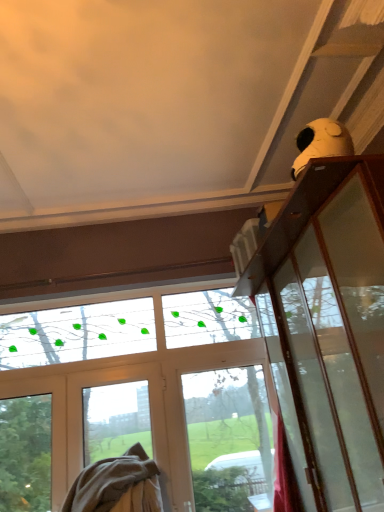
What do you see at coordinates (114, 442) in the screenshot? I see `white matte screen door at lower left` at bounding box center [114, 442].

At what (x,y) coordinates should I click in order to perform the action: click on white matte screen door at lower left. Please return your answer as a coordinate pair (x, y). The image size is (384, 512). Looking at the image, I should click on (114, 442).

Measure the distance between point (143, 507) and camera.

Point (143, 507) and camera are 8.64 feet apart.

What do you see at coordinates (117, 485) in the screenshot? I see `beige cotton blanket at lower left` at bounding box center [117, 485].

Identify the location of beige cotton blanket at lower left. (117, 485).

The width and height of the screenshot is (384, 512). Find the location of `white matte screen door at lower left`. white matte screen door at lower left is located at coordinates (114, 442).

Does beige cotton blanket at lower left appear on the right side of white matte screen door at lower left?

Incorrect, beige cotton blanket at lower left is not on the right side of white matte screen door at lower left.

Which is behind, beige cotton blanket at lower left or white matte screen door at lower left?

white matte screen door at lower left is further away from the camera.

Is point (115, 507) positioned behind point (91, 417)?

No.

From the image's perspective, which is below, beige cotton blanket at lower left or white matte screen door at lower left?

beige cotton blanket at lower left is shown below in the image.

From a real-world perspective, is beige cotton blanket at lower left located beneath white matte screen door at lower left?

Yes.

In the scene shown: In terms of width, does beige cotton blanket at lower left look wider or thinner when compared to white matte screen door at lower left?

In the image, beige cotton blanket at lower left appears to be wider than white matte screen door at lower left.

Who is shorter, beige cotton blanket at lower left or white matte screen door at lower left?

With less height is beige cotton blanket at lower left.

Can you confirm if beige cotton blanket at lower left is bigger than white matte screen door at lower left?

Yes, beige cotton blanket at lower left is bigger than white matte screen door at lower left.

Would you say beige cotton blanket at lower left is outside white matte screen door at lower left?

Yes.

Is beige cotton blanket at lower left not near white matte screen door at lower left?

No, beige cotton blanket at lower left is in close proximity to white matte screen door at lower left.

Based on the photo, is beige cotton blanket at lower left facing towards white matte screen door at lower left?

No, beige cotton blanket at lower left is not facing towards white matte screen door at lower left.

How many degrees apart are the facing directions of beige cotton blanket at lower left and white matte screen door at lower left?

The facing directions of beige cotton blanket at lower left and white matte screen door at lower left are 1.22 degrees apart.

How distant is beige cotton blanket at lower left from white matte screen door at lower left?

beige cotton blanket at lower left is 3.95 inches away from white matte screen door at lower left.

Find the location of a particular element. blanket that appears below the white matte screen door at lower left (from a real-world perspective) is located at coordinates (117, 485).

Considering the relative positions of white matte screen door at lower left and beige cotton blanket at lower left in the image provided, is white matte screen door at lower left to the left of beige cotton blanket at lower left from the viewer's perspective?

No, white matte screen door at lower left is not to the left of beige cotton blanket at lower left.

Relative to beige cotton blanket at lower left, is white matte screen door at lower left in front or behind?

In the image, white matte screen door at lower left appears behind beige cotton blanket at lower left.

Is point (155, 468) behind point (100, 466)?

Yes.

From the image's perspective, which object appears higher, white matte screen door at lower left or beige cotton blanket at lower left?

white matte screen door at lower left, from the image's perspective.

From a real-world perspective, which is physically below, white matte screen door at lower left or beige cotton blanket at lower left?

beige cotton blanket at lower left is physically lower.

In the scene shown: Considering the sizes of white matte screen door at lower left and beige cotton blanket at lower left in the image, is white matte screen door at lower left wider or thinner than beige cotton blanket at lower left?

Clearly, white matte screen door at lower left has less width compared to beige cotton blanket at lower left.

Considering the sizes of objects white matte screen door at lower left and beige cotton blanket at lower left in the image provided, who is taller, white matte screen door at lower left or beige cotton blanket at lower left?

Standing taller between the two is white matte screen door at lower left.

Does white matte screen door at lower left have a larger size compared to beige cotton blanket at lower left?

Incorrect, white matte screen door at lower left is not larger than beige cotton blanket at lower left.

Is beige cotton blanket at lower left completely or partially inside white matte screen door at lower left?

No, beige cotton blanket at lower left is not inside white matte screen door at lower left.

Is white matte screen door at lower left far away from beige cotton blanket at lower left?

No, white matte screen door at lower left is not far from beige cotton blanket at lower left.

Is white matte screen door at lower left turned away from beige cotton blanket at lower left?

Yes, white matte screen door at lower left's orientation is away from beige cotton blanket at lower left.

Can you tell me how much white matte screen door at lower left and beige cotton blanket at lower left differ in facing direction?

The facing directions of white matte screen door at lower left and beige cotton blanket at lower left are 1.22 degrees apart.

Measure the distance between white matte screen door at lower left and beige cotton blanket at lower left.

white matte screen door at lower left and beige cotton blanket at lower left are 3.95 inches apart from each other.

Where is `screen door above the beige cotton blanket at lower left (from a real-world perspective)`? screen door above the beige cotton blanket at lower left (from a real-world perspective) is located at coordinates (114, 442).

This screenshot has width=384, height=512. In the image, there is a white matte screen door at lower left. Find the location of `blanket below it (from the image's perspective)`. blanket below it (from the image's perspective) is located at coordinates (117, 485).

I want to click on blanket located underneath the white matte screen door at lower left (from a real-world perspective), so click(x=117, y=485).